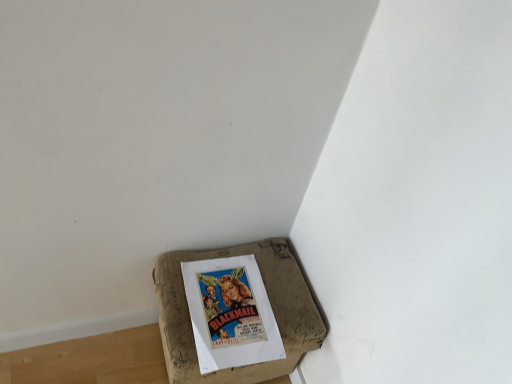
This screenshot has width=512, height=384. In order to click on free space above brown cardboard box at lower left (from a real-world perspective) in this screenshot , I will do `click(241, 294)`.